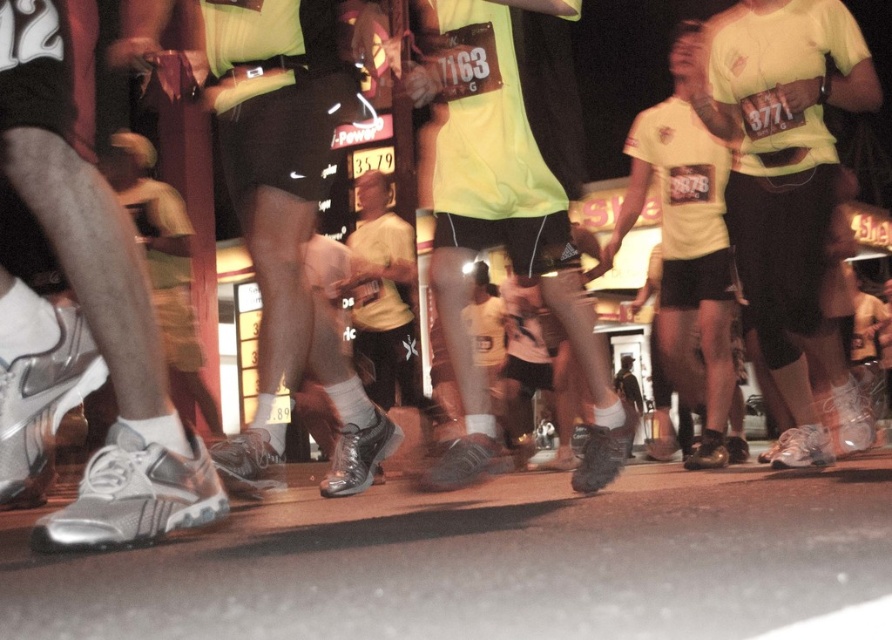
Question: Is the position of matte yellow shirt at center less distant than that of yellow matte shirt at center?

Choices:
 (A) yes
 (B) no

Answer: (A)

Question: Does silver metallic shoe at lower left have a smaller size compared to yellow matte shirt at center?

Choices:
 (A) yes
 (B) no

Answer: (A)

Question: Which object is closer to the camera taking this photo?

Choices:
 (A) yellow matte shirt at center
 (B) matte yellow shirt at center
 (C) matte white shoe at center

Answer: (B)

Question: Which object is closer to the camera taking this photo?

Choices:
 (A) matte white shoe at center
 (B) yellow matte shirt at center

Answer: (A)

Question: Is silver metallic shoe at lower left closer to the viewer compared to yellow matte shirt at center?

Choices:
 (A) no
 (B) yes

Answer: (B)

Question: Which point is farther to the camera?

Choices:
 (A) (92, 250)
 (B) (835, 4)
 (C) (362, 342)
 (D) (508, 1)

Answer: (C)